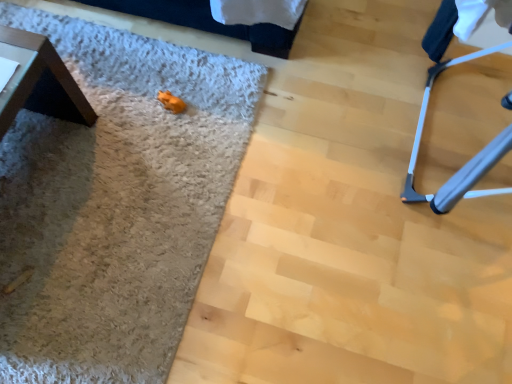
Identify the location of vacant region below white shaggy rug at lower left (from a real-world perspective). Image resolution: width=512 pixels, height=384 pixels. pyautogui.click(x=117, y=190).